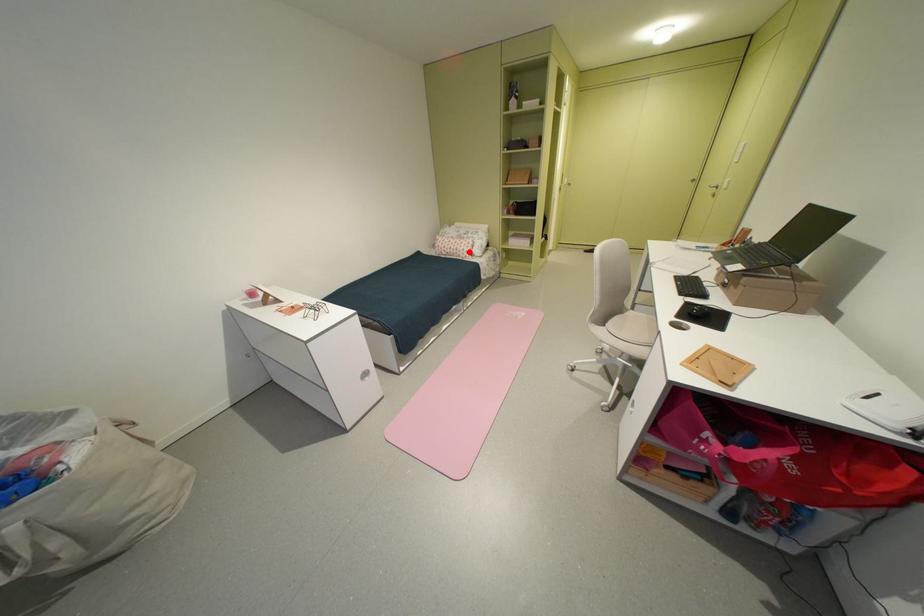
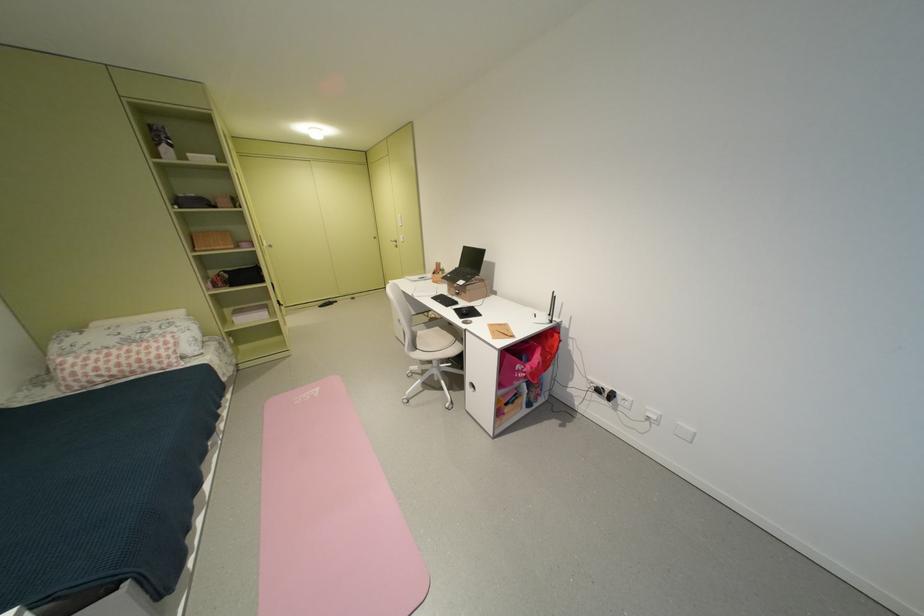
Question: I am providing you with two images of the same scene from different viewpoints. Image1 has a red point marked. In image2, the corresponding 3D location appears at what relative position? Reply with the corresponding letter.

Choices:
 (A) Closer
 (B) Farther

Answer: (B)